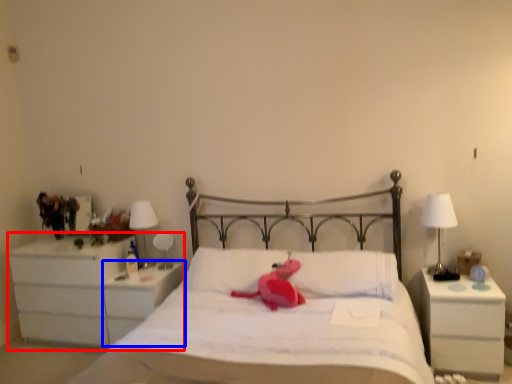
Question: Which object is further to the camera taking this photo, chest of drawers (highlighted by a red box) or nightstand (highlighted by a blue box)?

Choices:
 (A) chest of drawers
 (B) nightstand

Answer: (A)